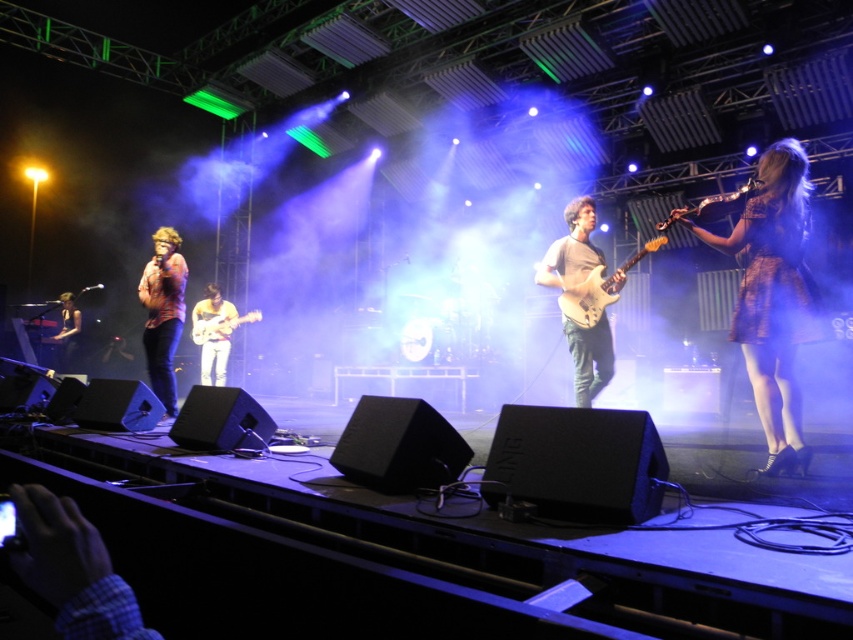
You are a stagehand preparing to move the shiny silver guitar at center and the shiny silver guitar at right. According to the stage layout, which guitar is positioned closer to the left side of the stage?

The shiny silver guitar at center is positioned closer to the left side of the stage because it is to the left of the shiny silver guitar at right.

You are a photographer positioned at the back of the venue. You want to capture a photo of both the matte gray guitar at center and the shiny silver guitar at right in the same frame. Based on their positions, which guitar should you focus on first to ensure both are in the frame?

The matte gray guitar at center is to the left of the shiny silver guitar at right, so you should focus on the shiny silver guitar at right first to ensure both guitars are captured in the frame.

You are an audience member sitting in the front row. You notice the striped shirt at center and the matte black guitar at left on stage. Which object is positioned closer to you?

The striped shirt at center is closer to the viewer than the matte black guitar at left.